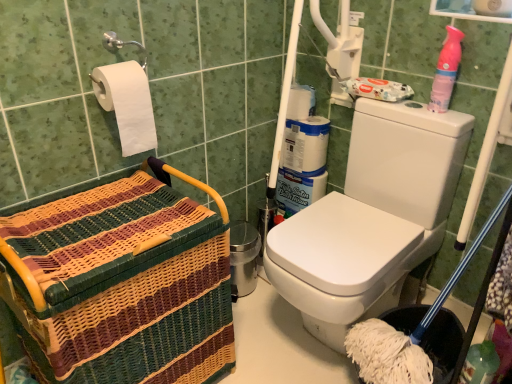
Question: In terms of width, does pink plastic spray bottle at upper right look wider or thinner when compared to white matte toilet paper at upper left?

Choices:
 (A) thin
 (B) wide

Answer: (A)

Question: Considering their positions, is pink plastic spray bottle at upper right located in front of or behind white matte toilet paper at upper left?

Choices:
 (A) front
 (B) behind

Answer: (B)

Question: Based on their relative distances, which object is farther from the pink plastic spray bottle at upper right?

Choices:
 (A) white matte toilet paper at upper left
 (B) woven wood basket at left

Answer: (B)

Question: Estimate the real-world distances between objects in this image. Which object is farther from the woven wood basket at left?

Choices:
 (A) white matte toilet paper at upper left
 (B) pink plastic spray bottle at upper right

Answer: (B)